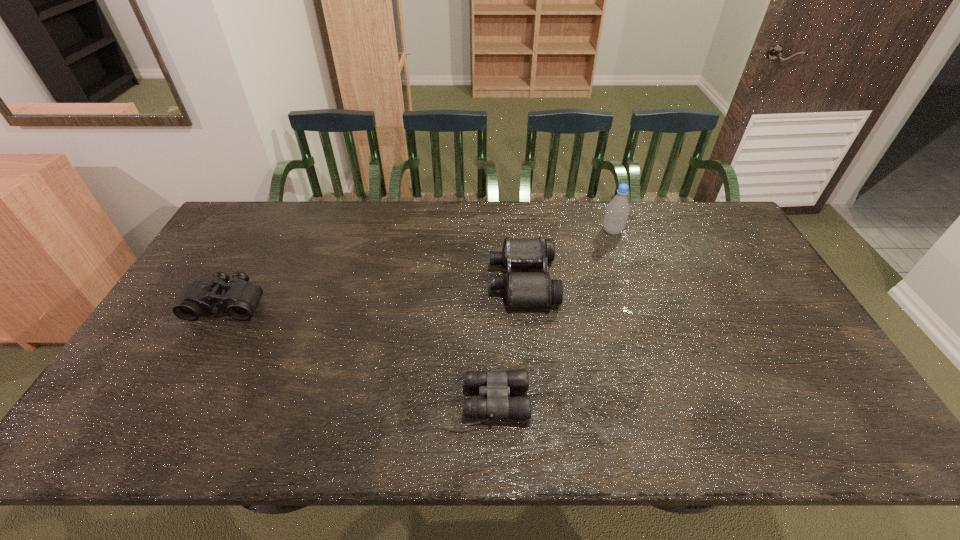
The height and width of the screenshot is (540, 960). What are the coordinates of `the farthest object` in the screenshot? It's located at click(617, 211).

I want to click on bottle, so click(617, 211).

Locate an element on the screen. the leftmost binoculars is located at coordinates (240, 298).

Where is `the shortest object`? Image resolution: width=960 pixels, height=540 pixels. the shortest object is located at coordinates (496, 385).

Locate an element on the screen. The image size is (960, 540). the shortest binoculars is located at coordinates (496, 385).

Identify the location of free space located on the left of the farthest object. Image resolution: width=960 pixels, height=540 pixels. (550, 231).

Locate an element on the screen. free spot located at the eyepieces of the leftmost binoculars is located at coordinates (197, 356).

Identify the location of blank area located at the eyepiece of the nearest object. click(x=641, y=403).

Where is `object located in the far edge section of the desktop`? object located in the far edge section of the desktop is located at coordinates [x=617, y=211].

Find the location of a particular element. This screenshot has height=540, width=960. object present at the near edge is located at coordinates (496, 385).